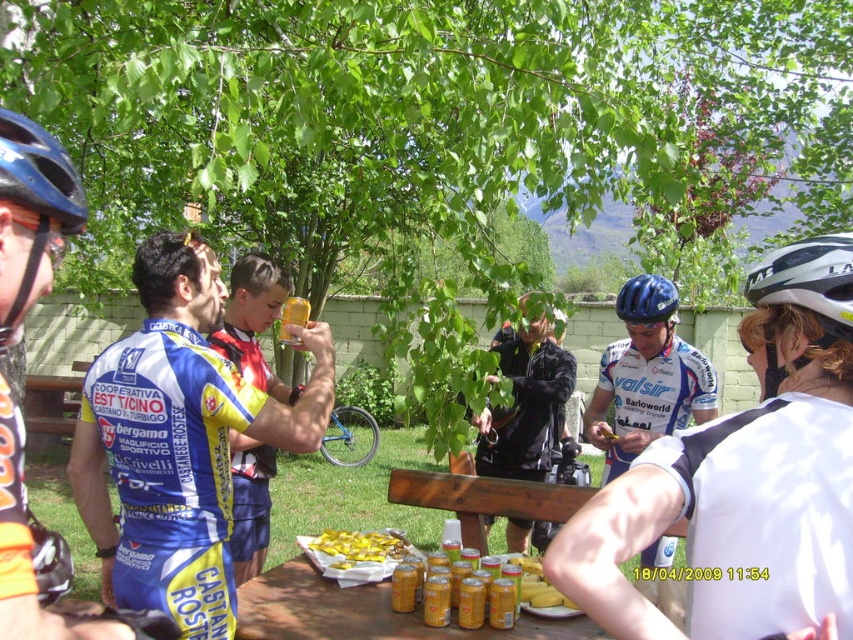
You are a cyclist who just arrived at the rest area and wants to place your yellow paper plate at center and yellow fabric jersey at center on the table. Which item will take up more space on the table?

The yellow fabric jersey at center takes up more space than the yellow paper plate at center because the yellow paper plate at center occupies less space than the yellow fabric jersey at center.

You are a cyclist who just arrived at the rest area and want to place your banana on the table. Where should you put it so it doesn 92tm overlap with the yellow paper plate at center?

The yellow paper plate at center is located at point (363, 612), so you should place the banana somewhere else on the table to avoid overlapping with it.

You are a photographer trying to capture a photo of the blue jersey at left and the blue matte helmet at center. If you want to ensure both are in focus, which object should you adjust your camera focus to prioritize?

The blue jersey at left is larger in size than the blue matte helmet at center, so you should prioritize focusing on the blue jersey at left to ensure both are in focus.